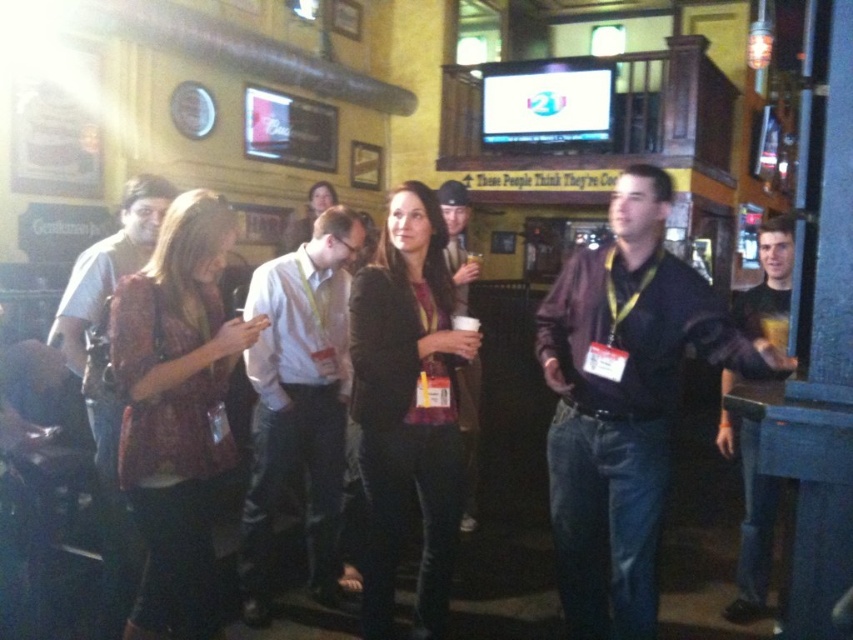
Question: Which point is farther to the camera?

Choices:
 (A) black leather jacket at right
 (B) dark brown leather jacket at center
 (C) matte brown shirt at left
 (D) white shirt at center

Answer: (A)

Question: Can you confirm if matte brown shirt at left is positioned above black leather jacket at right?

Choices:
 (A) yes
 (B) no

Answer: (A)

Question: Estimate the real-world distances between objects in this image. Which object is closer to the dark brown leather jacket at center?

Choices:
 (A) white shirt at center
 (B) matte brown shirt at left
 (C) black leather jacket at right
 (D) dark brown shirt at center

Answer: (A)

Question: Is dark brown shirt at center to the left of matte brown shirt at left from the viewer's perspective?

Choices:
 (A) no
 (B) yes

Answer: (A)

Question: Which point is farther to the camera?

Choices:
 (A) (466, 269)
 (B) (120, 525)

Answer: (A)

Question: Is white shirt at center further to the viewer compared to matte brown shirt at left?

Choices:
 (A) yes
 (B) no

Answer: (A)